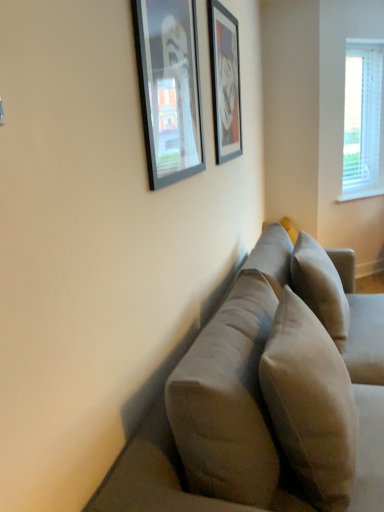
Question: Can you confirm if suede-like beige couch at center is bigger than beige fabric pillow at center, arranged as the 1th pillow when viewed from the back?

Choices:
 (A) yes
 (B) no

Answer: (A)

Question: From a real-world perspective, is suede-like beige couch at center located higher than beige fabric pillow at center, arranged as the 1th pillow when viewed from the back?

Choices:
 (A) yes
 (B) no

Answer: (B)

Question: From the image's perspective, does suede-like beige couch at center appear lower than beige fabric pillow at center, arranged as the second pillow when viewed from the front?

Choices:
 (A) yes
 (B) no

Answer: (A)

Question: Considering the relative sizes of suede-like beige couch at center and beige fabric pillow at center, arranged as the 1th pillow when viewed from the back, in the image provided, is suede-like beige couch at center shorter than beige fabric pillow at center, arranged as the 1th pillow when viewed from the back,?

Choices:
 (A) yes
 (B) no

Answer: (B)

Question: Is suede-like beige couch at center turned away from beige fabric pillow at center, arranged as the 1th pillow when viewed from the back?

Choices:
 (A) no
 (B) yes

Answer: (B)

Question: Considering the positions of beige fabric pillow at center, arranged as the second pillow when viewed from the front, and suede-like beige pillow at center, the first pillow viewed from the front, in the image, is beige fabric pillow at center, arranged as the second pillow when viewed from the front, taller or shorter than suede-like beige pillow at center, the first pillow viewed from the front,?

Choices:
 (A) tall
 (B) short

Answer: (A)

Question: From a real-world perspective, is beige fabric pillow at center, arranged as the second pillow when viewed from the front, positioned above or below suede-like beige pillow at center, which is the 2th pillow from back to front?

Choices:
 (A) below
 (B) above

Answer: (A)

Question: From the image's perspective, is beige fabric pillow at center, arranged as the 1th pillow when viewed from the back, positioned above or below suede-like beige pillow at center, which is the 2th pillow from back to front?

Choices:
 (A) below
 (B) above

Answer: (B)

Question: Is point (344, 306) closer or farther from the camera than point (342, 372)?

Choices:
 (A) farther
 (B) closer

Answer: (A)

Question: Based on their sizes in the image, would you say suede-like beige pillow at center, which is the 2th pillow from back to front, is bigger or smaller than matte black picture frame at upper center, positioned as the 1th picture frame in back-to-front order?

Choices:
 (A) small
 (B) big

Answer: (B)

Question: From the image's perspective, is suede-like beige pillow at center, which is the 2th pillow from back to front, above or below matte black picture frame at upper center, which is counted as the second picture frame, starting from the front?

Choices:
 (A) below
 (B) above

Answer: (A)

Question: Is suede-like beige pillow at center, which is the 2th pillow from back to front, taller or shorter than matte black picture frame at upper center, the second picture frame from the left?

Choices:
 (A) tall
 (B) short

Answer: (B)

Question: Is point (264, 350) closer or farther from the camera than point (228, 61)?

Choices:
 (A) closer
 (B) farther

Answer: (A)

Question: In terms of width, does suede-like beige couch at center look wider or thinner when compared to matte black picture frame at upper center, acting as the 1th picture frame starting from the right?

Choices:
 (A) wide
 (B) thin

Answer: (A)

Question: Based on their positions, is suede-like beige couch at center located to the left or right of matte black picture frame at upper center, acting as the 1th picture frame starting from the right?

Choices:
 (A) left
 (B) right

Answer: (B)